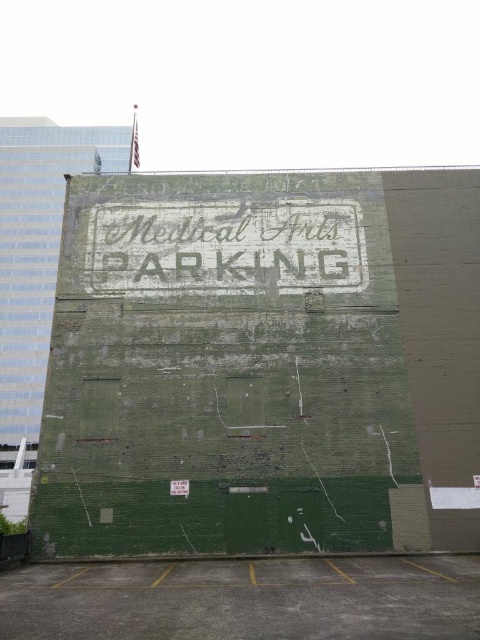
You are standing at the origin point of the coordinate system. You want to move to the gray concrete parking lot at lower center. What are the coordinates you need to move to?

The coordinates you need to move to are 0.938 in the x direction and 0.512 in the y direction.

You are a delivery driver who needs to park your vehicle in the gray concrete parking lot at lower center. There is a white distressed sign at center above it. Is the sign directly above the parking lot?

The gray concrete parking lot at lower center is positioned under the white distressed sign at center, so yes, the sign is directly above the parking lot.